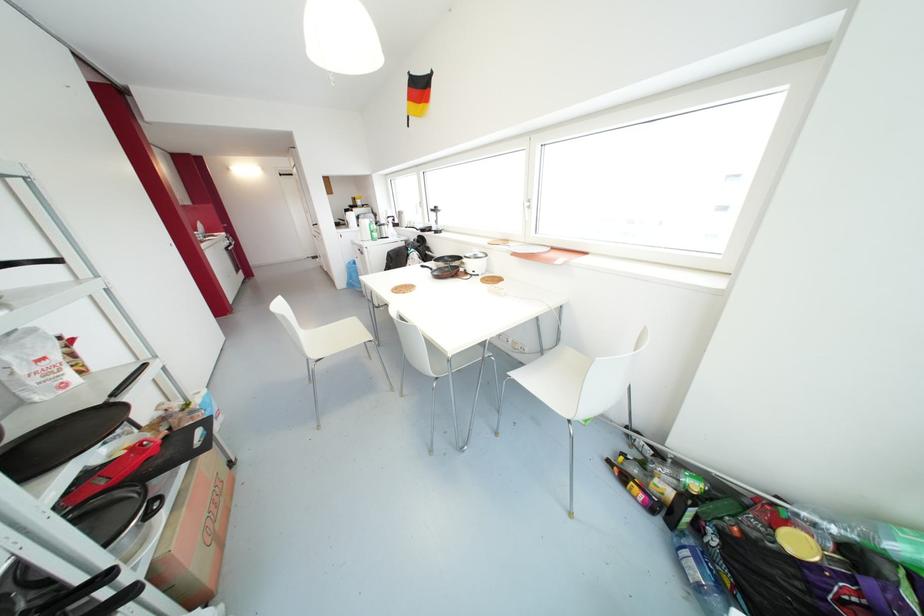
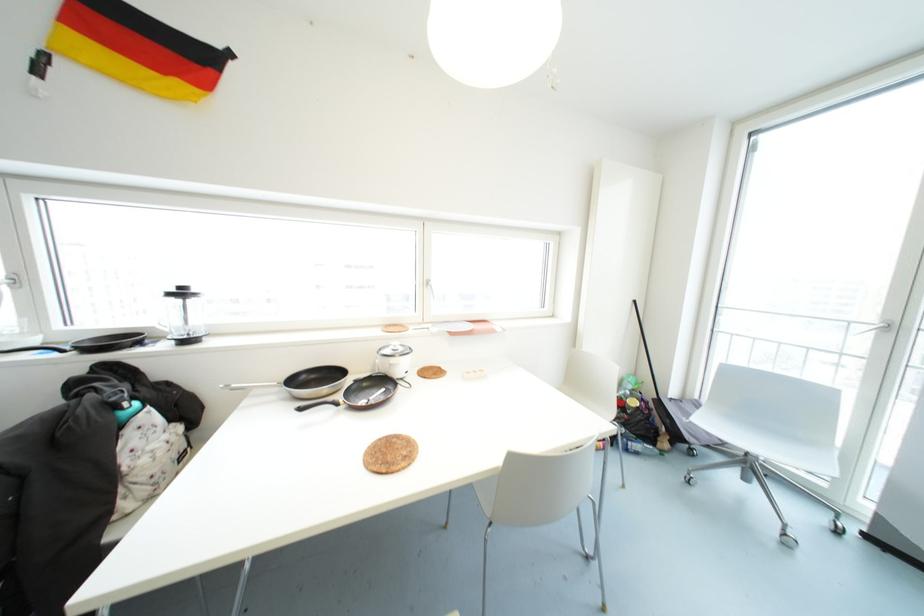
Question: I am providing you with two images of the same scene from different viewpoints. After the viewpoint changes to image2, which objects are now occluded?

Choices:
 (A) black pan handle
 (B) silver pan handle
 (C) black cart handle
 (D) green plastic bottle

Answer: (D)